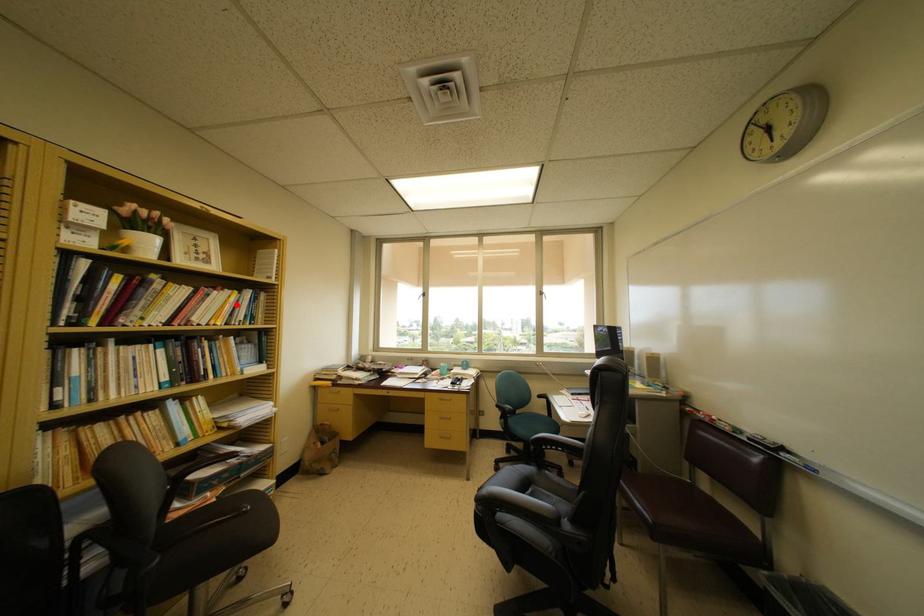
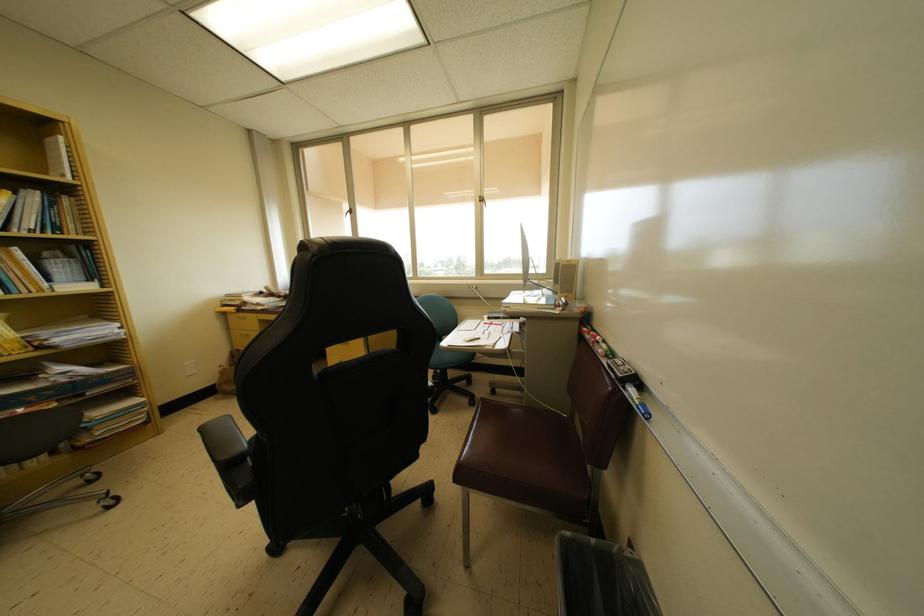
In the second image, find the point that corresponds to the highlighted location in the first image.

(7, 206)